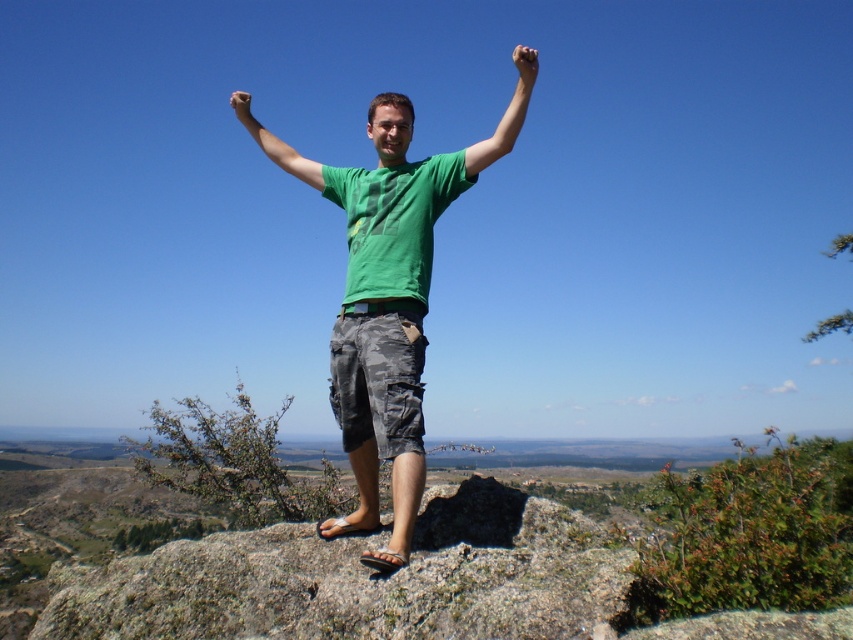
Question: Which object is farther from the camera taking this photo?

Choices:
 (A) green matte shirt at center
 (B) matte black hand at upper center
 (C) green matte shirt at upper center

Answer: (A)

Question: Which object is closer to the camera taking this photo?

Choices:
 (A) green matte shirt at center
 (B) matte green shirt at center
 (C) gray rough rock at center
 (D) green matte t-shirt at center

Answer: (C)

Question: Considering the relative positions of green matte t-shirt at center and green matte shirt at upper center in the image provided, where is green matte t-shirt at center located with respect to green matte shirt at upper center?

Choices:
 (A) below
 (B) above

Answer: (A)

Question: Considering the relative positions of matte black hand at upper center and matte green shirt at center in the image provided, where is matte black hand at upper center located with respect to matte green shirt at center?

Choices:
 (A) left
 (B) right

Answer: (B)

Question: Does green matte t-shirt at center come behind green matte shirt at center?

Choices:
 (A) yes
 (B) no

Answer: (B)

Question: Among these points, which one is nearest to the camera?

Choices:
 (A) (300, 170)
 (B) (277, 625)
 (C) (521, 51)

Answer: (B)